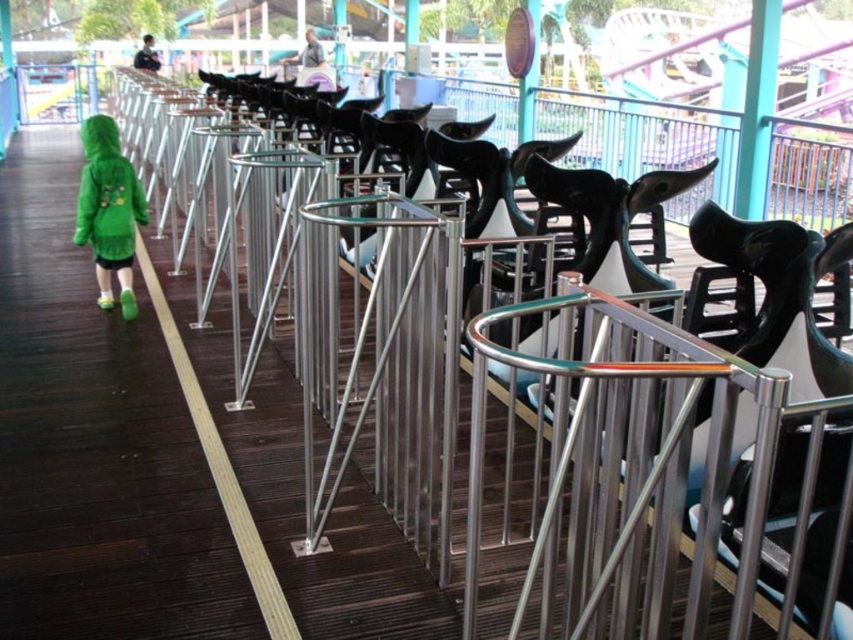
Which is above, blue metallic pole at upper right or brushed metal sign at upper center?

brushed metal sign at upper center is higher up.

The image size is (853, 640). I want to click on blue metallic pole at upper right, so click(x=757, y=109).

Where is `blue metallic pole at upper right`? The width and height of the screenshot is (853, 640). blue metallic pole at upper right is located at coordinates (757, 109).

Who is more forward, (105, 250) or (764, 86)?

Positioned in front is point (105, 250).

Measure the distance between green matte jacket at left and camera.

green matte jacket at left and camera are 4.40 meters apart.

The image size is (853, 640). I want to click on green matte jacket at left, so click(x=108, y=211).

Can you confirm if green matte jacket at left is bigger than brushed metal sign at upper center?

Correct, green matte jacket at left is larger in size than brushed metal sign at upper center.

The image size is (853, 640). What do you see at coordinates (108, 211) in the screenshot?
I see `green matte jacket at left` at bounding box center [108, 211].

Is point (119, 269) positioned before point (538, 81)?

Yes, point (119, 269) is closer to viewer.

Find the location of a particular element. This screenshot has height=640, width=853. green matte jacket at left is located at coordinates (108, 211).